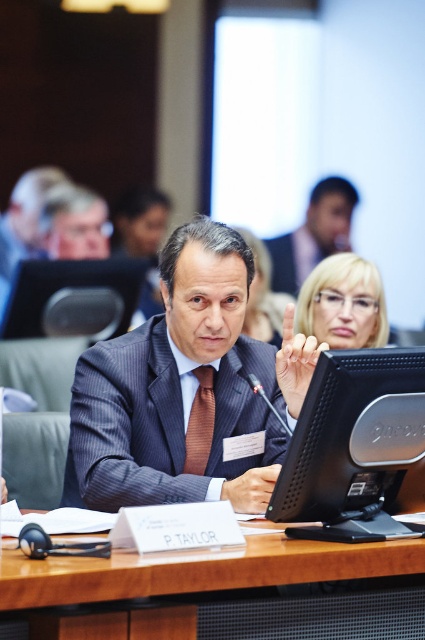
You are organizing a small presentation and need to place a 10 feet long banner between the wooden table at center and the dark gray pinstripe suit at center. Is there enough space to place the banner horizontally between them?

The distance between the wooden table at center and the dark gray pinstripe suit at center is 11.77 feet, which is more than the 10 feet length of the banner. Therefore, there is sufficient space to place the banner horizontally between them.

You are an event organizer setting up a photo shoot for the conference. You need to ensure that the matte blue pinstripe suit at center and the brown striped tie at center are visible in the frame. Based on their sizes, which one should you focus on to ensure both are in focus?

The matte blue pinstripe suit at center has a greater height compared to brown striped tie at center, so focusing on the larger matte blue pinstripe suit at center will ensure both are in focus.

You are organizing a presentation and need to place a laptop on the wooden table at center. The laptop is as wide as the matte blue pinstripe suit at center. Can the laptop fit on the table?

The wooden table at center might be wider than the matte blue pinstripe suit at center, so the laptop, which is as wide as the suit, could potentially fit on the table.